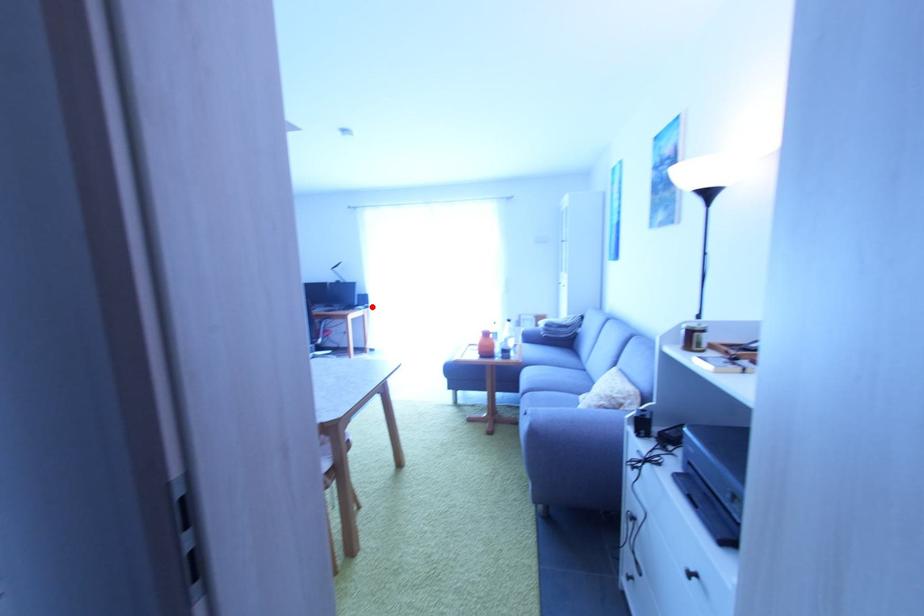
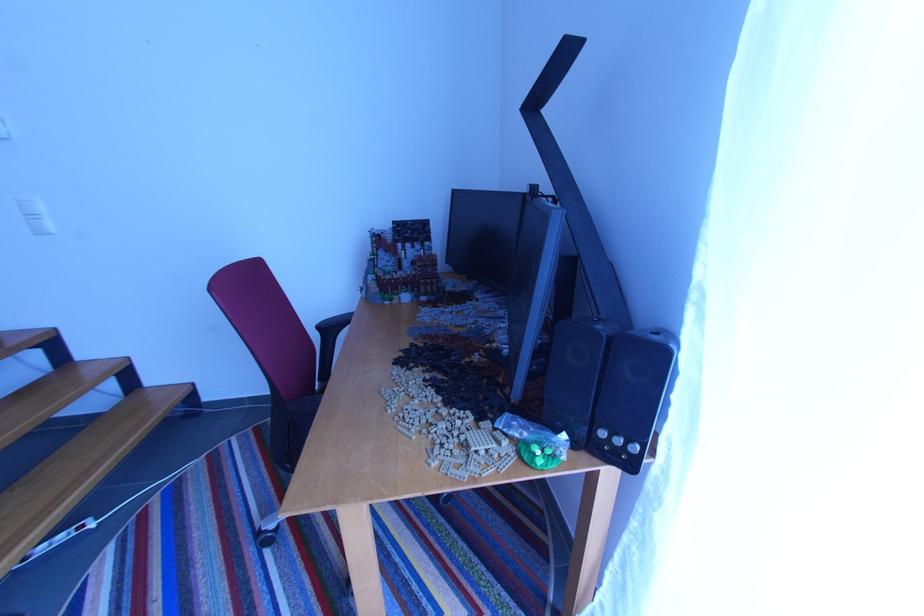
Where in the second image is the point corresponding to the highlighted location from the first image?

(623, 443)